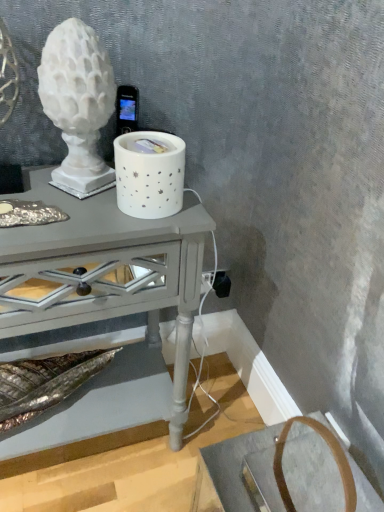
Question: In the image, is white matte sculpture at upper left, the first candle holder when ordered from left to right, on the left side or the right side of matte gray table at center?

Choices:
 (A) right
 (B) left

Answer: (A)

Question: Looking at their shapes, would you say white matte sculpture at upper left, the first candle holder when ordered from left to right, is wider or thinner than matte gray table at center?

Choices:
 (A) thin
 (B) wide

Answer: (A)

Question: Which object is the farthest from the black plastic outlet at lower right?

Choices:
 (A) white matte sculpture at upper left, the 2th candle holder positioned from the right
 (B) white ceramic candle holder at center, the 1th candle holder positioned from the right
 (C) matte gray table at center

Answer: (A)

Question: Which is nearer to the black plastic outlet at lower right?

Choices:
 (A) matte gray table at center
 (B) white ceramic candle holder at center, the 1th candle holder positioned from the right
 (C) white matte sculpture at upper left, the first candle holder when ordered from left to right

Answer: (A)